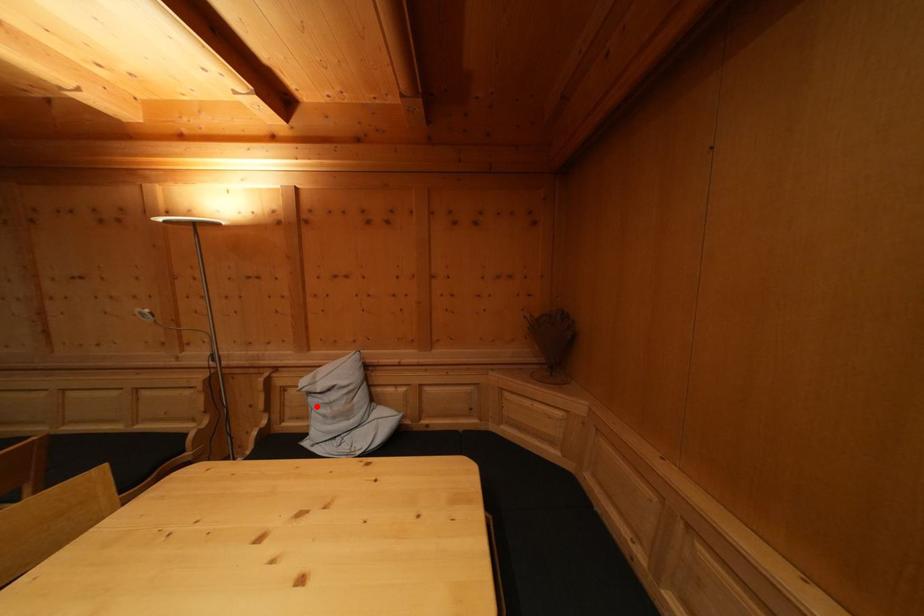
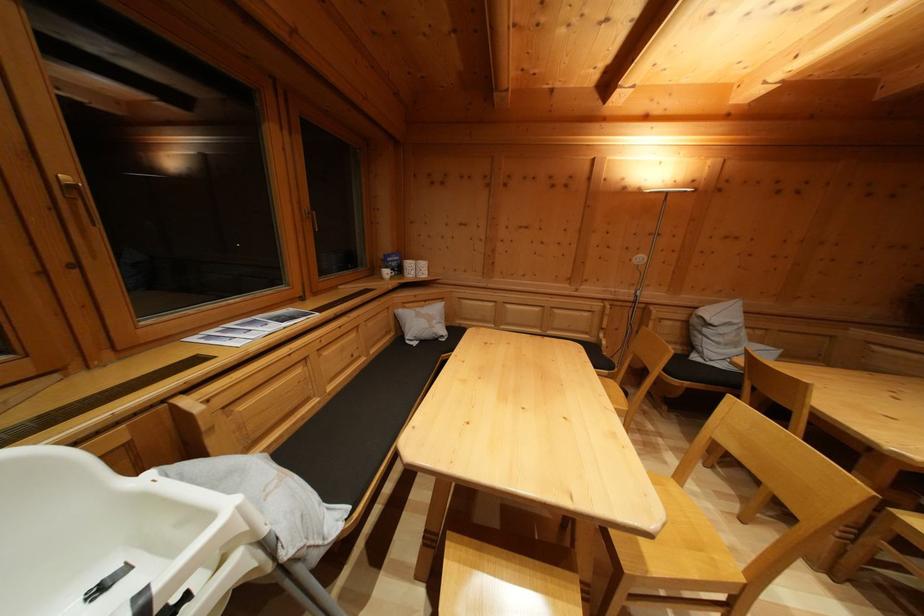
Question: I am providing you with two images of the same scene from different viewpoints. Given a red point in image1, look at the same physical point in image2. Is it:

Choices:
 (A) Closer to the viewpoint
 (B) Farther from the viewpoint

Answer: (A)